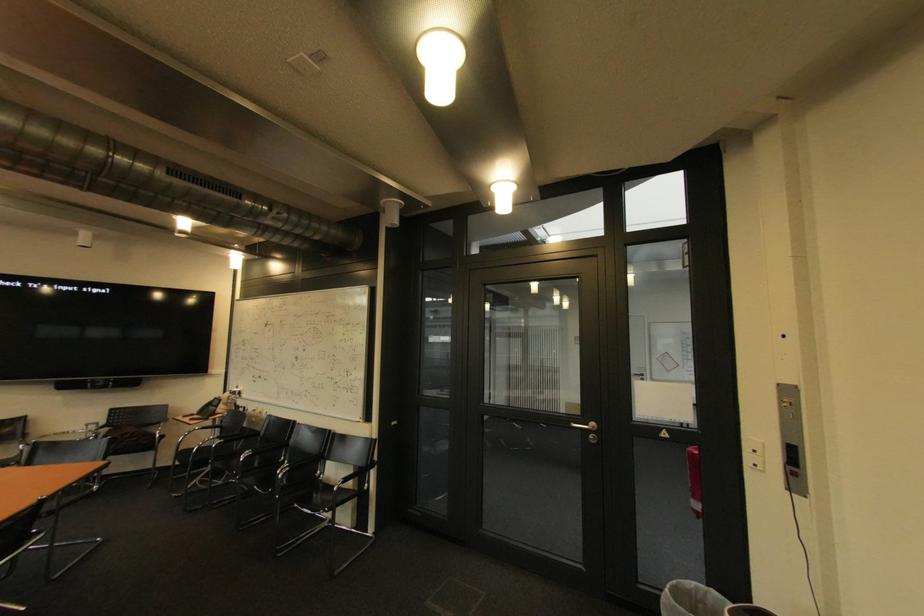
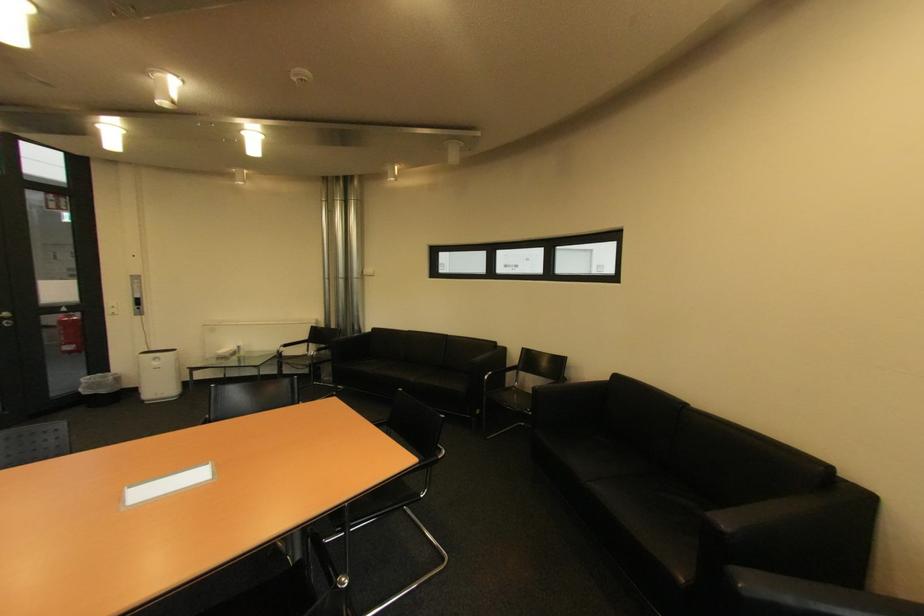
In the second image, find the point that corresponds to (x=789, y=402) in the first image.

(140, 283)